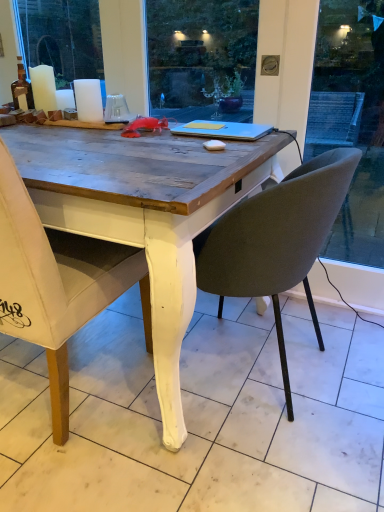
Measure the distance between point (37, 87) and camera.

Point (37, 87) and camera are 1.79 meters apart.

Locate an element on the screen. This screenshot has width=384, height=512. white painted wood leg at lower center is located at coordinates (201, 416).

Image resolution: width=384 pixels, height=512 pixels. Find the location of `blue matte laptop at center`. blue matte laptop at center is located at coordinates (223, 130).

Where is `white matte candle at upper left, which appears as the 1th candle when viewed from the left`? The height and width of the screenshot is (512, 384). white matte candle at upper left, which appears as the 1th candle when viewed from the left is located at coordinates (43, 88).

There is a matte gray chair at center, acting as the first chair starting from the right. Where is `the 2nd candle above it (from the image's perspective)`? the 2nd candle above it (from the image's perspective) is located at coordinates (43, 88).

From a real-world perspective, who is located lower, matte gray chair at center, acting as the first chair starting from the right, or white matte candle at upper left, which appears as the 1th candle when viewed from the left?

matte gray chair at center, acting as the first chair starting from the right.

How far apart are matte gray chair at center, acting as the first chair starting from the right, and white matte candle at upper left, which ranks as the second candle in right-to-left order?

A distance of 3.81 feet exists between matte gray chair at center, acting as the first chair starting from the right, and white matte candle at upper left, which ranks as the second candle in right-to-left order.

Can you confirm if matte gray chair at center, the second chair from the left, is thinner than white matte candle at upper left, which ranks as the second candle in right-to-left order?

Incorrect, the width of matte gray chair at center, the second chair from the left, is not less than that of white matte candle at upper left, which ranks as the second candle in right-to-left order.

Between blue matte laptop at center and white matte candle at upper left, arranged as the 2th candle when viewed from the left, which one appears on the left side from the viewer's perspective?

white matte candle at upper left, arranged as the 2th candle when viewed from the left.

Is blue matte laptop at center smaller than white matte candle at upper left, acting as the 1th candle starting from the right?

Incorrect, blue matte laptop at center is not smaller in size than white matte candle at upper left, acting as the 1th candle starting from the right.

Can you confirm if blue matte laptop at center is shorter than white matte candle at upper left, acting as the 1th candle starting from the right?

Yes, blue matte laptop at center is shorter than white matte candle at upper left, acting as the 1th candle starting from the right.

From the image's perspective, starting from the blue matte laptop at center, which candle is the 1st one above? Please provide its 2D coordinates.

[(88, 100)]

Considering their positions, is white matte candle at upper left, which appears as the 1th candle when viewed from the left, located in front of or behind white fabric chair at left, which is the second chair from right to left?

white matte candle at upper left, which appears as the 1th candle when viewed from the left, is positioned farther from the viewer than white fabric chair at left, which is the second chair from right to left.

From a real-world perspective, is white matte candle at upper left, which ranks as the second candle in right-to-left order, positioned under white fabric chair at left, the 1th chair when ordered from left to right, based on gravity?

No, from a real-world perspective, white matte candle at upper left, which ranks as the second candle in right-to-left order, is not beneath white fabric chair at left, the 1th chair when ordered from left to right.

Which is behind, point (48, 67) or point (23, 298)?

The point (48, 67) is more distant.

In the scene shown: Would you say white painted wood leg at lower center is to the left or to the right of white matte candle at upper left, which appears as the 1th candle when viewed from the left, in the picture?

Clearly, white painted wood leg at lower center is on the right of white matte candle at upper left, which appears as the 1th candle when viewed from the left, in the image.

Consider the image. Considering the sizes of white painted wood leg at lower center and white matte candle at upper left, which ranks as the second candle in right-to-left order, in the image, is white painted wood leg at lower center taller or shorter than white matte candle at upper left, which ranks as the second candle in right-to-left order,?

In the image, white painted wood leg at lower center appears to be shorter than white matte candle at upper left, which ranks as the second candle in right-to-left order.

How far apart are blue matte laptop at center and white painted wood leg at lower center?

blue matte laptop at center and white painted wood leg at lower center are 35.24 inches apart from each other.

Can you confirm if blue matte laptop at center is wider than white painted wood leg at lower center?

No.

Which object is closer to the camera taking this photo, blue matte laptop at center or white painted wood leg at lower center?

Positioned in front is white painted wood leg at lower center.

Considering the relative sizes of blue matte laptop at center and white painted wood leg at lower center in the image provided, is blue matte laptop at center smaller than white painted wood leg at lower center?

Yes.

Does white painted wood leg at lower center touch white fabric chair at left, which is the second chair from right to left?

white painted wood leg at lower center and white fabric chair at left, which is the second chair from right to left, are clearly separated.

From the picture: From a real-world perspective, is white painted wood leg at lower center located higher than white fabric chair at left, which is the second chair from right to left?

No, from a real-world perspective, white painted wood leg at lower center is not over white fabric chair at left, which is the second chair from right to left

Considering the sizes of objects white painted wood leg at lower center and white fabric chair at left, the 1th chair when ordered from left to right, in the image provided, who is bigger, white painted wood leg at lower center or white fabric chair at left, the 1th chair when ordered from left to right,?

Bigger between the two is white fabric chair at left, the 1th chair when ordered from left to right.

What's the angular difference between white fabric chair at left, which is the second chair from right to left, and white matte candle at upper left, arranged as the 2th candle when viewed from the left,'s facing directions?

They differ by 180 degrees in their facing directions.

You are a GUI agent. You are given a task and a screenshot of the screen. Output one action in this format:
    pyautogui.click(x=<x>, y=<y>)
    Task: Click on the 2nd chair in front when counting from the white matte candle at upper left, acting as the 1th candle starting from the right
    This screenshot has width=384, height=512.
    Given the screenshot: What is the action you would take?
    click(x=57, y=283)

Is point (31, 278) more distant than point (84, 91)?

No, it is in front of (84, 91).

Considering the positions of objects white fabric chair at left, the 1th chair when ordered from left to right, and white matte candle at upper left, acting as the 1th candle starting from the right, in the image provided, who is behind, white fabric chair at left, the 1th chair when ordered from left to right, or white matte candle at upper left, acting as the 1th candle starting from the right,?

white matte candle at upper left, acting as the 1th candle starting from the right, is behind.

Where is `the 2nd chair below the white matte candle at upper left, which appears as the 1th candle when viewed from the left (from the image's perspective)`? The image size is (384, 512). the 2nd chair below the white matte candle at upper left, which appears as the 1th candle when viewed from the left (from the image's perspective) is located at coordinates (276, 239).

What are the coordinates of `the 1st candle behind the blue matte laptop at center` in the screenshot? It's located at (88, 100).

From the image, which object appears to be farther from white fabric chair at left, the 1th chair when ordered from left to right, matte gray chair at center, acting as the first chair starting from the right, or white painted wood leg at lower center?

matte gray chair at center, acting as the first chair starting from the right, lies further to white fabric chair at left, the 1th chair when ordered from left to right, than the other object.

Estimate the real-world distances between objects in this image. Which object is closer to white matte candle at upper left, which ranks as the second candle in right-to-left order, white matte candle at upper left, arranged as the 2th candle when viewed from the left, or white fabric chair at left, the 1th chair when ordered from left to right?

Among the two, white matte candle at upper left, arranged as the 2th candle when viewed from the left, is located nearer to white matte candle at upper left, which ranks as the second candle in right-to-left order.

Looking at the image, which one is located closer to white fabric chair at left, which is the second chair from right to left, white painted wood leg at lower center or white matte candle at upper left, acting as the 1th candle starting from the right?

The object closer to white fabric chair at left, which is the second chair from right to left, is white painted wood leg at lower center.

Based on their spatial positions, is white painted wood leg at lower center or white matte candle at upper left, acting as the 1th candle starting from the right, further from white matte candle at upper left, which appears as the 1th candle when viewed from the left?

white painted wood leg at lower center lies further to white matte candle at upper left, which appears as the 1th candle when viewed from the left, than the other object.

From the picture: Considering their positions, is white painted wood leg at lower center positioned closer to white matte candle at upper left, arranged as the 2th candle when viewed from the left, than white matte candle at upper left, which appears as the 1th candle when viewed from the left?

white matte candle at upper left, which appears as the 1th candle when viewed from the left, is closer to white matte candle at upper left, arranged as the 2th candle when viewed from the left.

Considering their positions, is white matte candle at upper left, which appears as the 1th candle when viewed from the left, positioned further to matte gray chair at center, the second chair from the left, than white fabric chair at left, which is the second chair from right to left?

white matte candle at upper left, which appears as the 1th candle when viewed from the left, lies further to matte gray chair at center, the second chair from the left, than the other object.

Consider the image. Considering their positions, is white fabric chair at left, which is the second chair from right to left, positioned further to white painted wood leg at lower center than blue matte laptop at center?

blue matte laptop at center.

When comparing their distances from matte gray chair at center, the second chair from the left, does blue matte laptop at center or white painted wood leg at lower center seem closer?

blue matte laptop at center is closer to matte gray chair at center, the second chair from the left.

Identify the location of laptop between white matte candle at upper left, acting as the 1th candle starting from the right, and white painted wood leg at lower center, in the vertical direction. Image resolution: width=384 pixels, height=512 pixels. (223, 130).

Find the location of `tile between white fabric chair at left, the 1th chair when ordered from left to right, and matte gray chair at center, acting as the first chair starting from the right, in the horizontal direction`. tile between white fabric chair at left, the 1th chair when ordered from left to right, and matte gray chair at center, acting as the first chair starting from the right, in the horizontal direction is located at coordinates (201, 416).

The width and height of the screenshot is (384, 512). Identify the location of candle between white fabric chair at left, the 1th chair when ordered from left to right, and white matte candle at upper left, which ranks as the second candle in right-to-left order, in the front-back direction. (88, 100).

Find the location of a particular element. Image resolution: width=384 pixels, height=512 pixels. chair positioned between white fabric chair at left, which is the second chair from right to left, and white matte candle at upper left, which appears as the 1th candle when viewed from the left, from near to far is located at coordinates (276, 239).